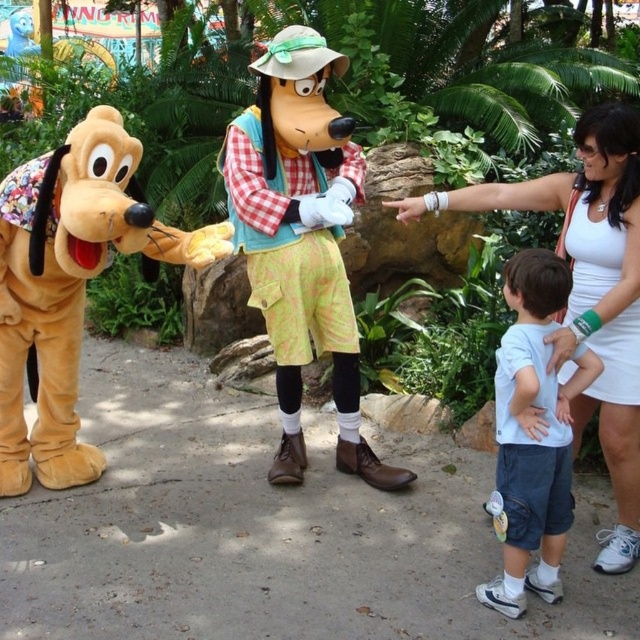
Describe the element at coordinates (589, 292) in the screenshot. I see `white fabric at right` at that location.

Who is lower down, white fabric at right or white matte tank top at right?

Positioned lower is white fabric at right.

Between point (563, 323) and point (582, 257), which one is positioned in front?

Point (582, 257) is more forward.

What are the coordinates of `white fabric at right` in the screenshot? It's located at (589, 292).

Can you confirm if white fabric at right is positioned to the left of light blue t-shirt at center?

No, white fabric at right is not to the left of light blue t-shirt at center.

Does white fabric at right have a lesser width compared to light blue t-shirt at center?

No.

Is point (608, 122) closer to camera compared to point (531, 376)?

No, (608, 122) is further to viewer.

I want to click on white fabric at right, so click(x=589, y=292).

Between light blue t-shirt at center and white matte tank top at right, which one has more height?

With more height is light blue t-shirt at center.

Does light blue t-shirt at center come behind white matte tank top at right?

No, light blue t-shirt at center is closer to the viewer.

This screenshot has width=640, height=640. Identify the location of light blue t-shirt at center. (532, 435).

Locate an element on the screen. light blue t-shirt at center is located at coordinates (532, 435).